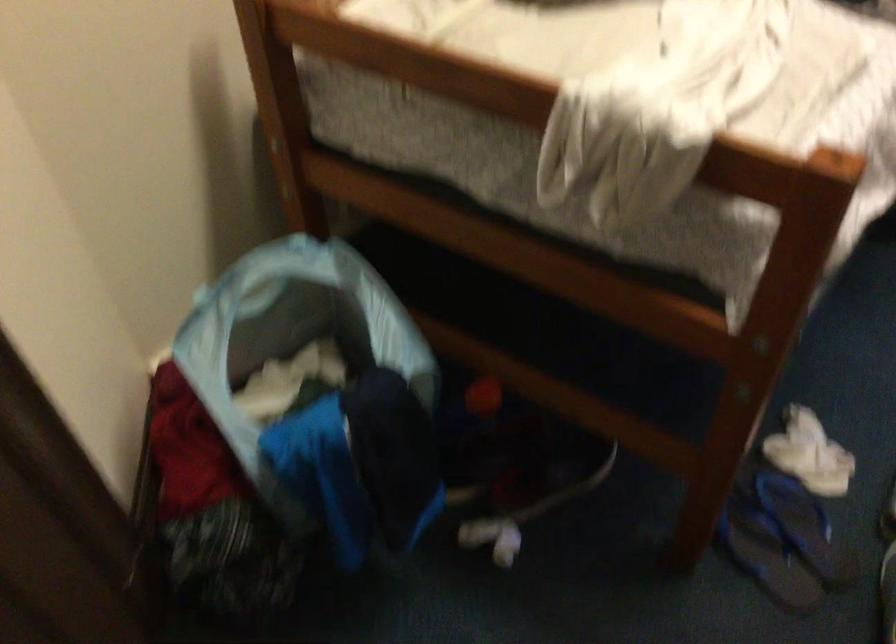
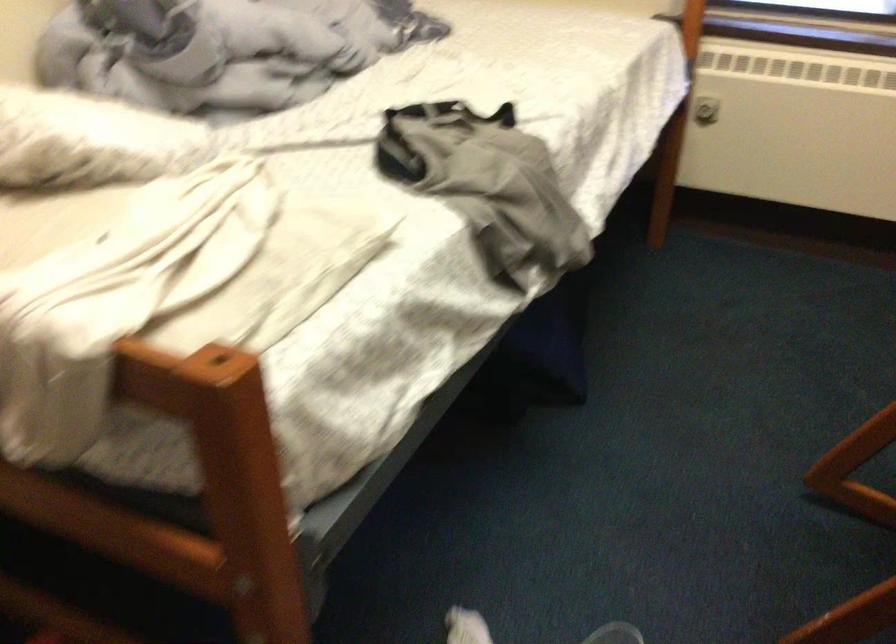
Question: The images are taken continuously from a first-person perspective. In which direction is your viewpoint rotating?

Choices:
 (A) Left
 (B) Right
 (C) Up
 (D) Down

Answer: (C)